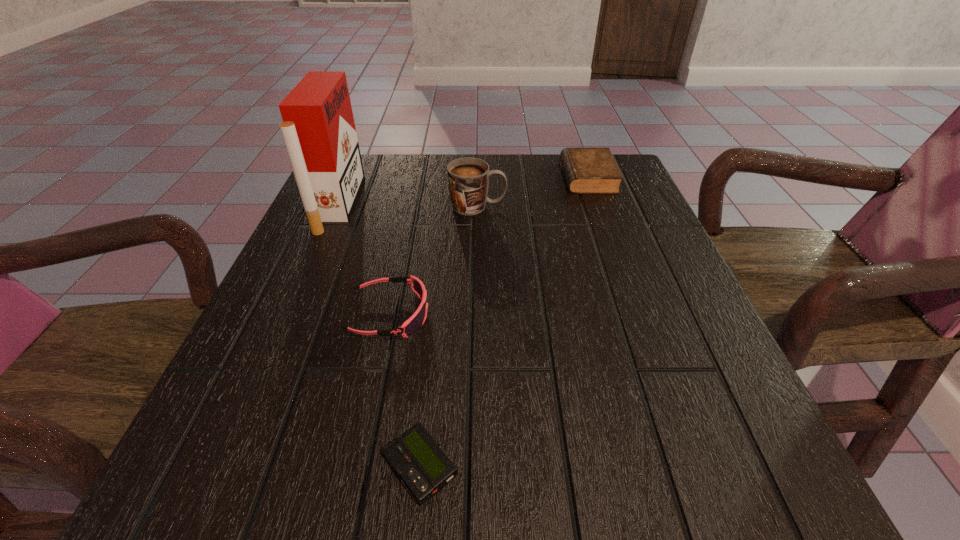
The height and width of the screenshot is (540, 960). Identify the location of free location located 0.140m on the spine side of the rightmost object. (510, 177).

Locate an element on the screen. The image size is (960, 540). free space located 0.200m on the spine side of the rightmost object is located at coordinates (487, 177).

The height and width of the screenshot is (540, 960). In order to click on vacant point located on the spine side of the rightmost object in this screenshot , I will do `click(411, 177)`.

This screenshot has height=540, width=960. In order to click on free space located 0.210m on the right of the beeper in this screenshot , I will do `click(616, 467)`.

This screenshot has height=540, width=960. What are the coordinates of `cigarette case positioned at the far edge` in the screenshot? It's located at tap(318, 129).

Identify the location of mug at the far edge. The image size is (960, 540). (468, 178).

Identify the location of diary situated at the far edge. (587, 170).

Identify the location of object at the near edge. (416, 458).

This screenshot has width=960, height=540. What are the coordinates of `object that is at the left edge` in the screenshot? It's located at (318, 129).

Where is `object that is at the right edge`? object that is at the right edge is located at coordinates (587, 170).